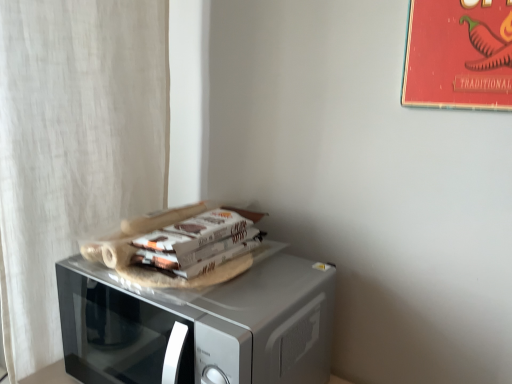
Question: Is silver metallic microwave at center bigger than red paper poster at upper right?

Choices:
 (A) no
 (B) yes

Answer: (B)

Question: Can you confirm if silver metallic microwave at center is positioned to the right of red paper poster at upper right?

Choices:
 (A) yes
 (B) no

Answer: (B)

Question: Can you see silver metallic microwave at center touching red paper poster at upper right?

Choices:
 (A) yes
 (B) no

Answer: (B)

Question: Is red paper poster at upper right a part of silver metallic microwave at center?

Choices:
 (A) yes
 (B) no

Answer: (B)

Question: Is silver metallic microwave at center not within red paper poster at upper right?

Choices:
 (A) no
 (B) yes

Answer: (B)

Question: Is red paper poster at upper right taller or shorter than silver metallic microwave at center?

Choices:
 (A) short
 (B) tall

Answer: (B)

Question: Considering their positions, is red paper poster at upper right located in front of or behind silver metallic microwave at center?

Choices:
 (A) front
 (B) behind

Answer: (A)

Question: Looking at their shapes, would you say red paper poster at upper right is wider or thinner than silver metallic microwave at center?

Choices:
 (A) thin
 (B) wide

Answer: (A)

Question: Is red paper poster at upper right situated inside silver metallic microwave at center or outside?

Choices:
 (A) outside
 (B) inside

Answer: (A)

Question: Considering their positions, is white textured curtain at left located in front of or behind silver metallic microwave at center?

Choices:
 (A) behind
 (B) front

Answer: (A)

Question: Is white textured curtain at left taller or shorter than silver metallic microwave at center?

Choices:
 (A) tall
 (B) short

Answer: (A)

Question: Does point (130, 26) appear closer or farther from the camera than point (309, 364)?

Choices:
 (A) closer
 (B) farther

Answer: (B)

Question: Would you say white textured curtain at left is to the left or to the right of silver metallic microwave at center in the picture?

Choices:
 (A) left
 (B) right

Answer: (A)

Question: Looking at their shapes, would you say red paper poster at upper right is wider or thinner than white textured curtain at left?

Choices:
 (A) wide
 (B) thin

Answer: (B)

Question: Is red paper poster at upper right taller or shorter than white textured curtain at left?

Choices:
 (A) short
 (B) tall

Answer: (A)